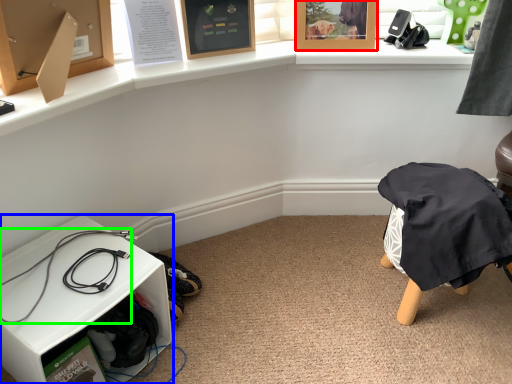
Question: Based on their relative distances, which object is farther from picture frame (highlighted by a red box)? Choose from furniture (highlighted by a blue box) and wire (highlighted by a green box).

Choices:
 (A) furniture
 (B) wire

Answer: (A)